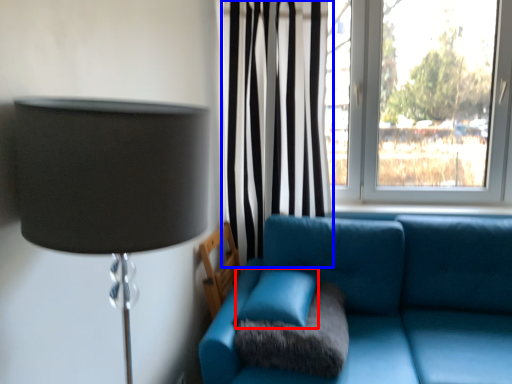
Question: Which of the following is the farthest to the observer, turquoise (highlighted by a red box) or curtain (highlighted by a blue box)?

Choices:
 (A) turquoise
 (B) curtain

Answer: (B)